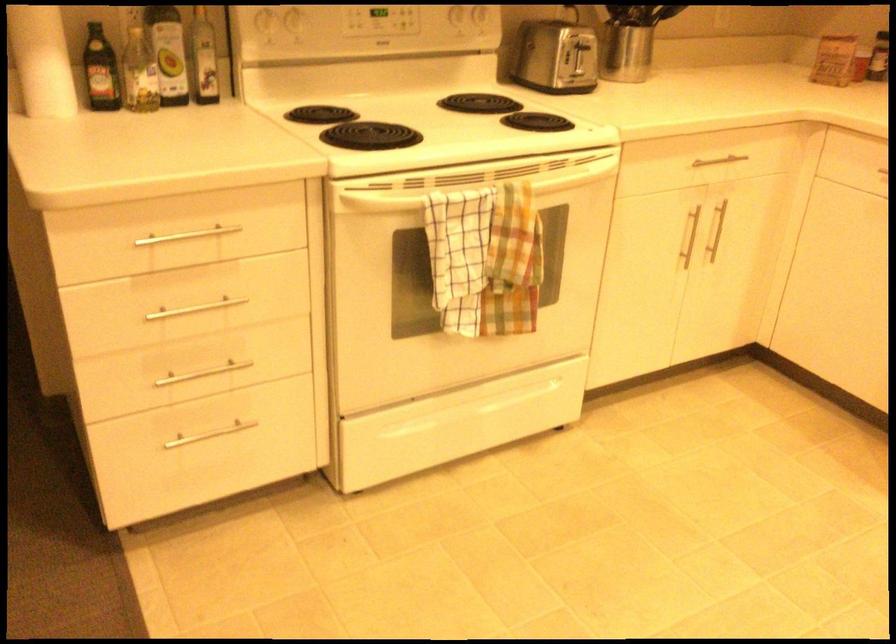
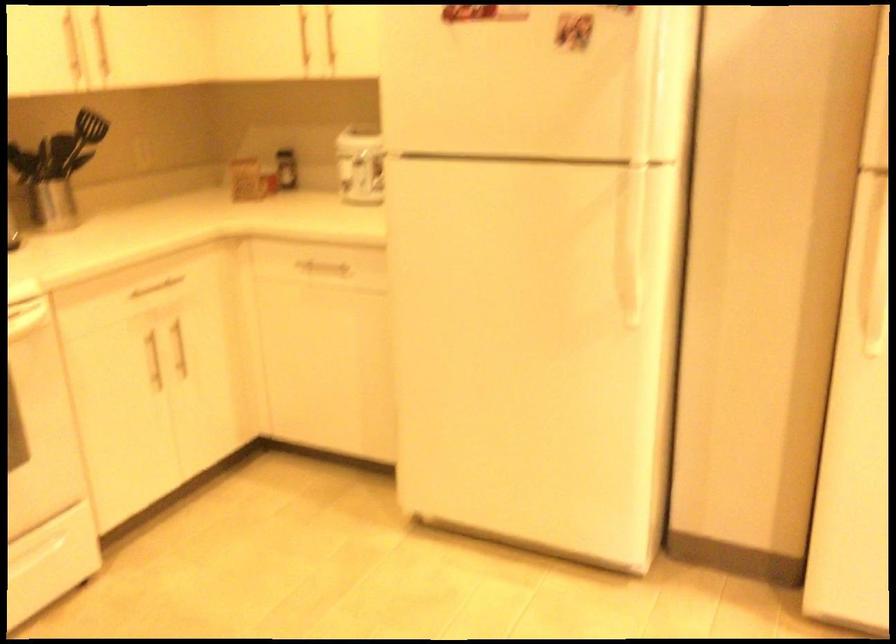
Question: How did the camera likely rotate?

Choices:
 (A) Left
 (B) Right
 (C) Up
 (D) Down

Answer: (B)